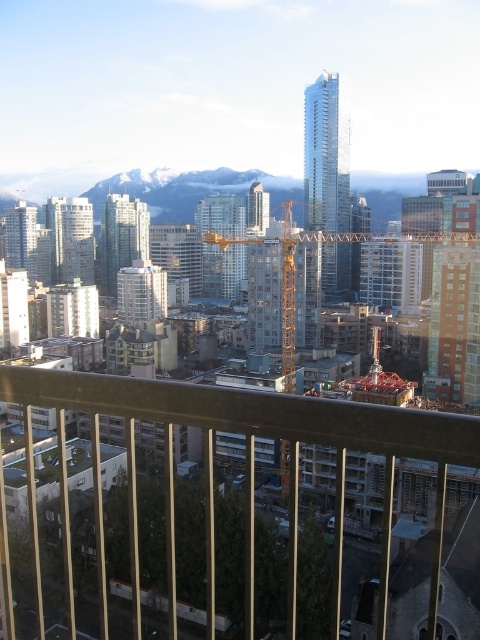
Does metal construction crane at center have a smaller size compared to yellow metallic crane at center?

Yes, metal construction crane at center is smaller than yellow metallic crane at center.

Which of these two, metal construction crane at center or yellow metallic crane at center, stands shorter?

Standing shorter between the two is metal construction crane at center.

Is point (444, 442) closer to camera compared to point (292, 324)?

Yes, point (444, 442) is closer to viewer.

Identify the location of metal construction crane at center. (247, 448).